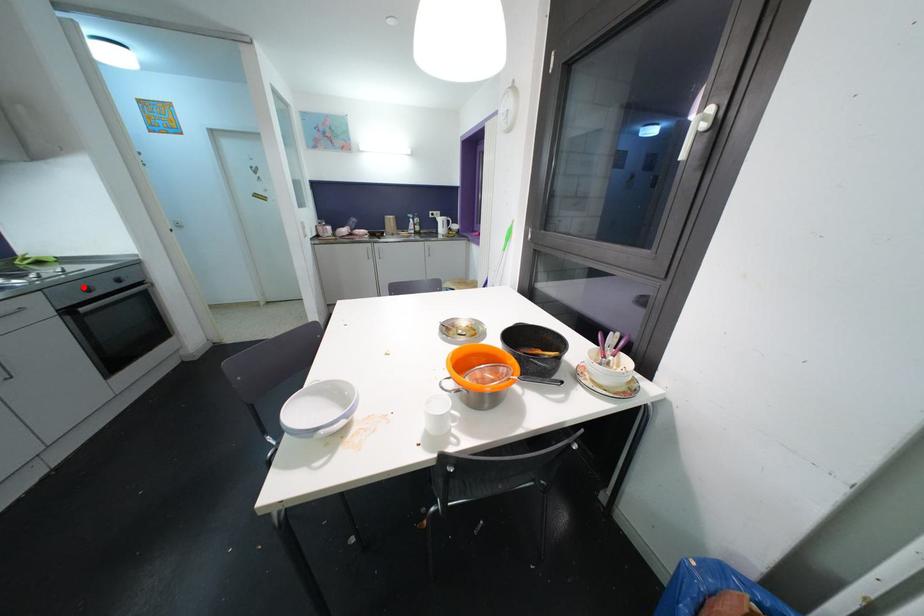
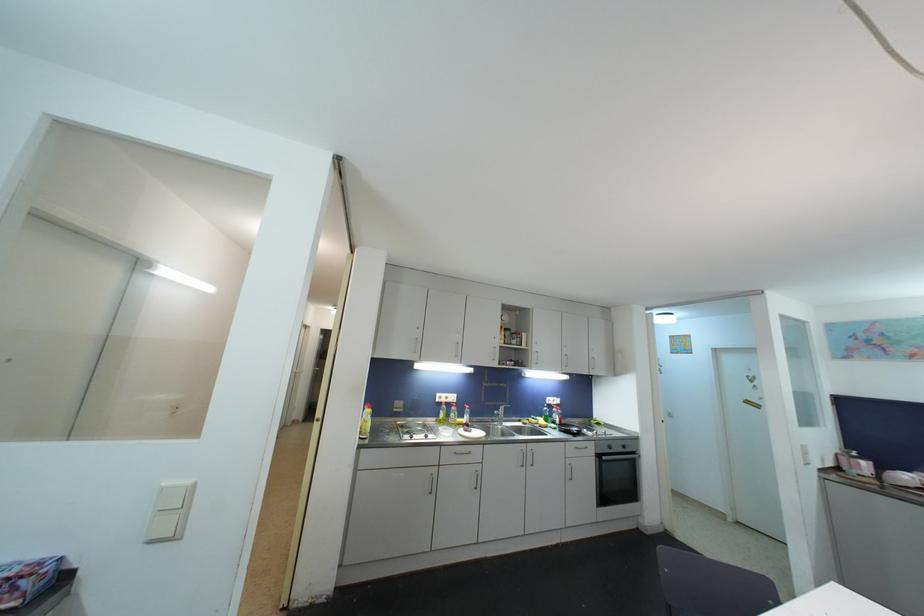
Where in the second image is the point corresponding to the highlighted location from the first image?

(611, 446)